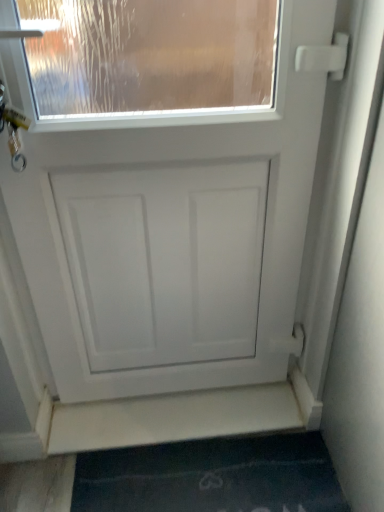
Question: Is dark blue carpet at lower center thinner than white matte stairwell at lower center?

Choices:
 (A) no
 (B) yes

Answer: (A)

Question: Is white matte stairwell at lower center at the back of dark blue carpet at lower center?

Choices:
 (A) no
 (B) yes

Answer: (B)

Question: From a real-world perspective, is dark blue carpet at lower center located beneath white matte stairwell at lower center?

Choices:
 (A) no
 (B) yes

Answer: (B)

Question: Considering the relative sizes of dark blue carpet at lower center and white matte stairwell at lower center in the image provided, is dark blue carpet at lower center wider than white matte stairwell at lower center?

Choices:
 (A) no
 (B) yes

Answer: (B)

Question: Can you confirm if dark blue carpet at lower center is positioned to the left of white matte stairwell at lower center?

Choices:
 (A) yes
 (B) no

Answer: (B)

Question: Based on their sizes in the image, would you say white matte door at center is bigger or smaller than white matte stairwell at lower center?

Choices:
 (A) small
 (B) big

Answer: (B)

Question: From a real-world perspective, is white matte door at center physically located above or below white matte stairwell at lower center?

Choices:
 (A) below
 (B) above

Answer: (B)

Question: Is white matte door at center situated inside white matte stairwell at lower center or outside?

Choices:
 (A) inside
 (B) outside

Answer: (B)

Question: Is point (39, 92) positioned closer to the camera than point (147, 410)?

Choices:
 (A) closer
 (B) farther

Answer: (B)

Question: Based on their sizes in the image, would you say white matte door at center is bigger or smaller than dark blue carpet at lower center?

Choices:
 (A) big
 (B) small

Answer: (A)

Question: From a real-world perspective, is white matte door at center above or below dark blue carpet at lower center?

Choices:
 (A) below
 (B) above

Answer: (B)

Question: Is point (226, 373) positioned closer to the camera than point (327, 501)?

Choices:
 (A) farther
 (B) closer

Answer: (A)

Question: Is white matte door at center inside the boundaries of dark blue carpet at lower center, or outside?

Choices:
 (A) inside
 (B) outside

Answer: (B)

Question: Is dark blue carpet at lower center taller or shorter than white matte door at center?

Choices:
 (A) short
 (B) tall

Answer: (A)

Question: Considering their positions, is dark blue carpet at lower center located in front of or behind white matte door at center?

Choices:
 (A) front
 (B) behind

Answer: (B)